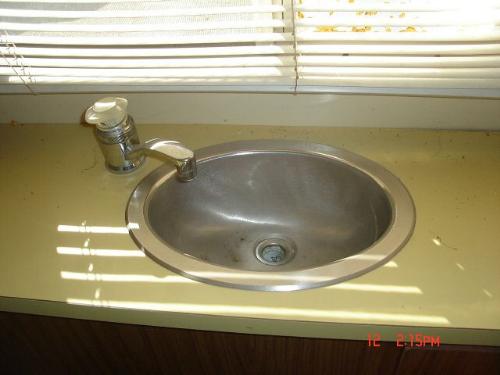
You are a GUI agent. You are given a task and a screenshot of the screen. Output one action in this format:
    pyautogui.click(x=<x>, y=<y>)
    Task: Click on the dirty marks on surface
    
    Given the screenshot: What is the action you would take?
    pyautogui.click(x=460, y=155)